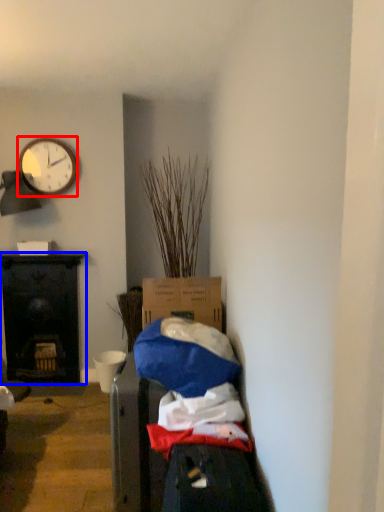
Question: Which object is further to the camera taking this photo, clock (highlighted by a red box) or desk (highlighted by a blue box)?

Choices:
 (A) clock
 (B) desk

Answer: (B)